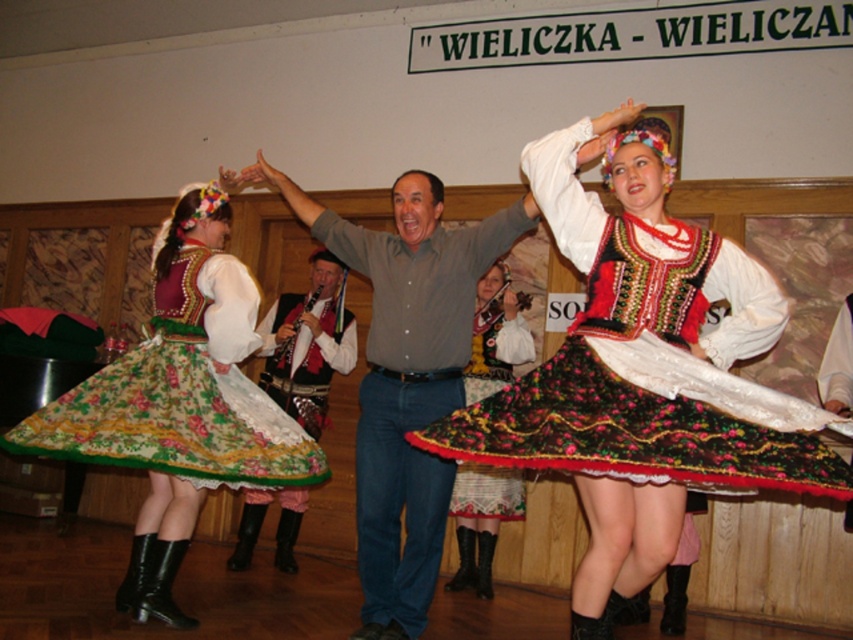
You are a photographer setting up equipment in the center of the dance hall. You need to position a camera stand that requires 1 meter of space. You see the floral cotton skirt at center and the matte gray shirt at center. Can you determine if there is enough space between them to place the camera stand?

The floral cotton skirt at center might be wider than matte gray shirt at center, but without exact measurements, it is uncertain if there is enough space between them to place the camera stand that requires 1 meter of space. Further measurement is needed.

You are an event planner preparing for a cultural festival. You need to decide which skirt to feature in the dance performance. The floral cotton skirt at center and the floral fabric skirt at center are both options. Based on their sizes, which one would be more suitable for a grand entrance where a larger presence is desired?

The floral cotton skirt at center has a larger size compared to the floral fabric skirt at center, making it more suitable for a grand entrance where a larger presence is desired.

You are a photographer at the event and want to capture the floral cotton skirt at center and the matte gray shirt at center in a single photo. Which object should you focus on first to ensure it appears in the foreground?

The floral cotton skirt at center is located above the matte gray shirt at center, so focusing on the floral cotton skirt at center first will ensure it appears in the foreground.